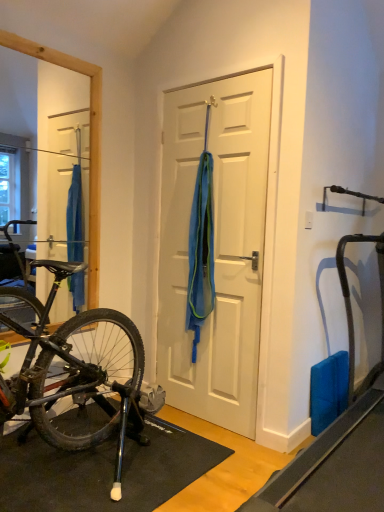
Question: Can you confirm if blue mesh towel at center is shorter than blue rubber mat at right?

Choices:
 (A) no
 (B) yes

Answer: (A)

Question: Considering the relative sizes of blue mesh towel at center and blue rubber mat at right in the image provided, is blue mesh towel at center smaller than blue rubber mat at right?

Choices:
 (A) yes
 (B) no

Answer: (A)

Question: From a real-world perspective, is blue mesh towel at center located higher than blue rubber mat at right?

Choices:
 (A) yes
 (B) no

Answer: (A)

Question: Is blue mesh towel at center far away from blue rubber mat at right?

Choices:
 (A) yes
 (B) no

Answer: (A)

Question: Considering the relative sizes of blue mesh towel at center and blue rubber mat at right in the image provided, is blue mesh towel at center bigger than blue rubber mat at right?

Choices:
 (A) no
 (B) yes

Answer: (A)

Question: Is blue mesh towel at center positioned with its back to blue rubber mat at right?

Choices:
 (A) no
 (B) yes

Answer: (A)

Question: Could you tell me if blue rubber mat at right is facing blue mesh towel at center?

Choices:
 (A) yes
 (B) no

Answer: (B)

Question: Can you confirm if blue rubber mat at right is positioned to the right of blue mesh towel at center?

Choices:
 (A) no
 (B) yes

Answer: (B)

Question: From the image's perspective, is blue rubber mat at right on top of blue mesh towel at center?

Choices:
 (A) yes
 (B) no

Answer: (B)

Question: Considering the relative sizes of blue rubber mat at right and blue mesh towel at center in the image provided, is blue rubber mat at right taller than blue mesh towel at center?

Choices:
 (A) yes
 (B) no

Answer: (B)

Question: Can you confirm if blue rubber mat at right is shorter than blue mesh towel at center?

Choices:
 (A) no
 (B) yes

Answer: (B)

Question: Is blue rubber mat at right not close to blue mesh towel at center?

Choices:
 (A) yes
 (B) no

Answer: (A)

Question: Considering the relative sizes of white matte door at center and blue rubber mat at right in the image provided, is white matte door at center smaller than blue rubber mat at right?

Choices:
 (A) yes
 (B) no

Answer: (A)